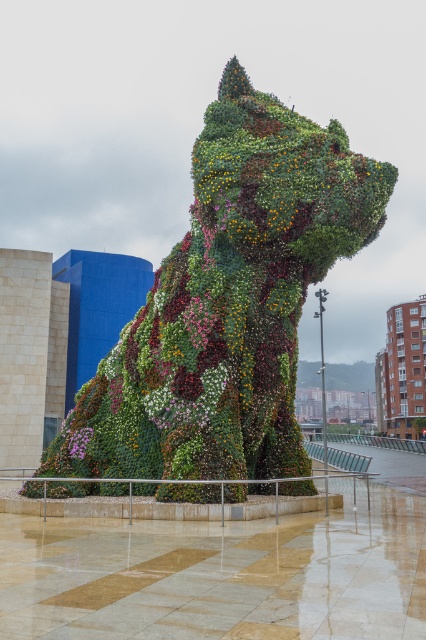
Question: Can you confirm if floral greenery dog at center is positioned to the left of pink matte flower at center?

Choices:
 (A) yes
 (B) no

Answer: (B)

Question: Does floral greenery dog at center lie in front of pink matte flower at center?

Choices:
 (A) no
 (B) yes

Answer: (B)

Question: Which point is farther to the camera?

Choices:
 (A) floral greenery dog at center
 (B) pink matte flower at center

Answer: (B)

Question: Is floral greenery dog at center behind pink matte flower at center?

Choices:
 (A) yes
 (B) no

Answer: (B)

Question: Which of the following is the farthest from the observer?

Choices:
 (A) floral greenery dog at center
 (B) pink matte flower at center

Answer: (B)